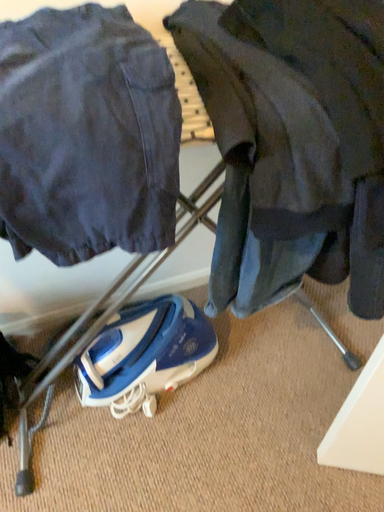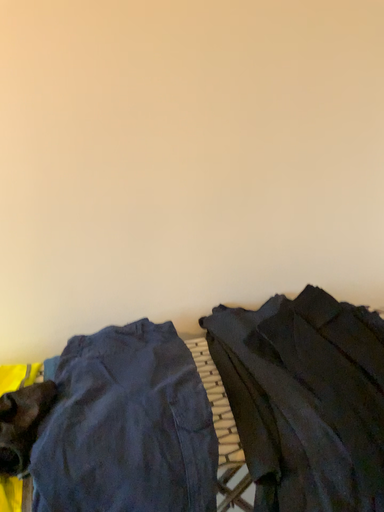
Question: How did the camera likely rotate when shooting the video?

Choices:
 (A) rotated upward
 (B) rotated downward

Answer: (A)